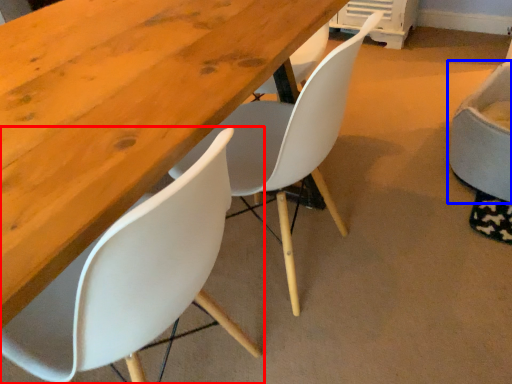
Question: Which of the following is the closest to the observer, chair (highlighted by a red box) or chair (highlighted by a blue box)?

Choices:
 (A) chair
 (B) chair

Answer: (A)